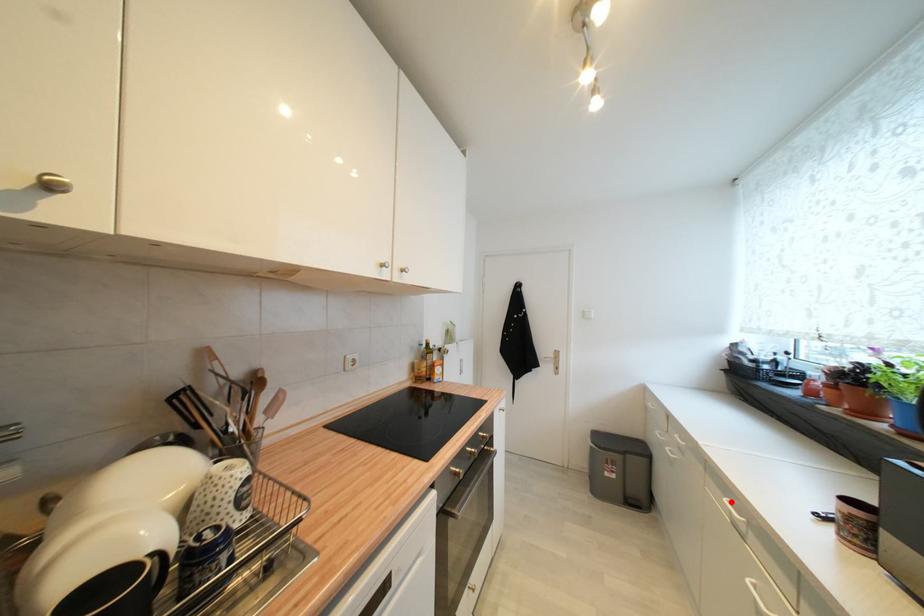
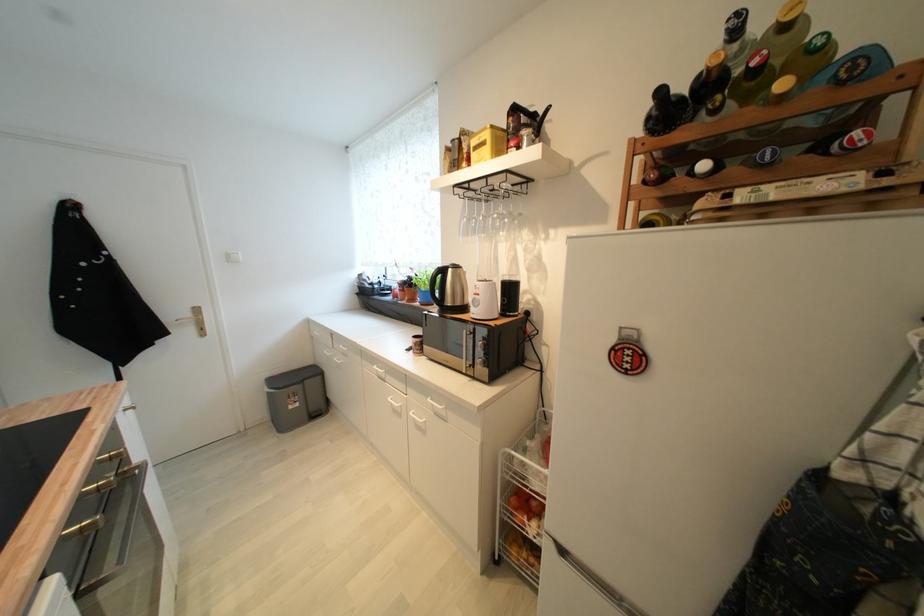
Where in the second image is the point corresponding to the highlighted location from the first image?

(380, 369)